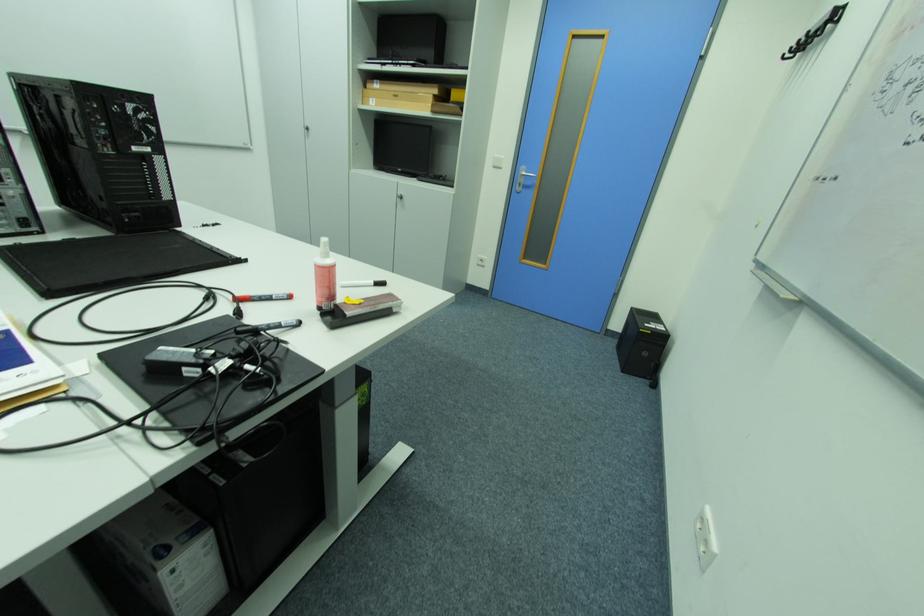
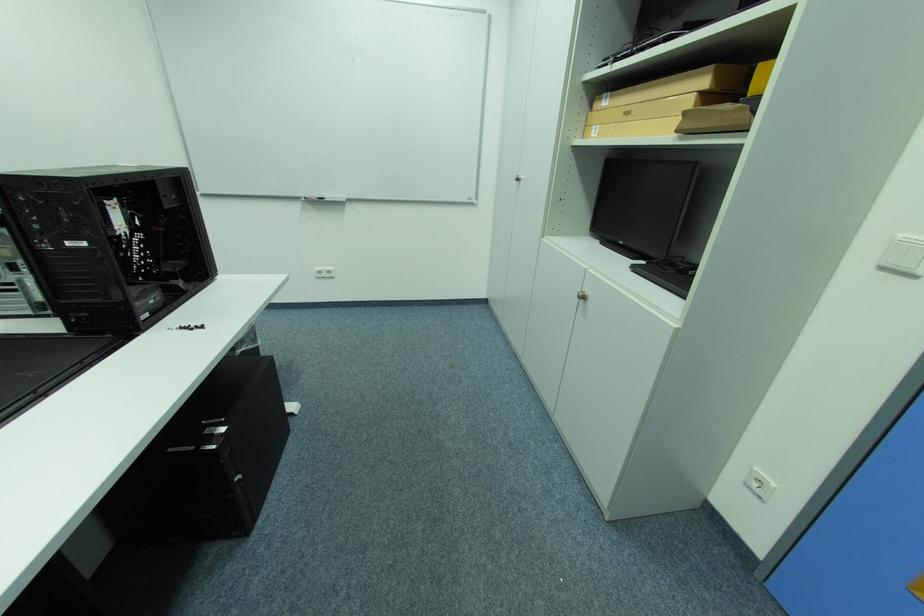
Where in the second image is the point corresponding to [379,100] from the first image?

(602, 128)